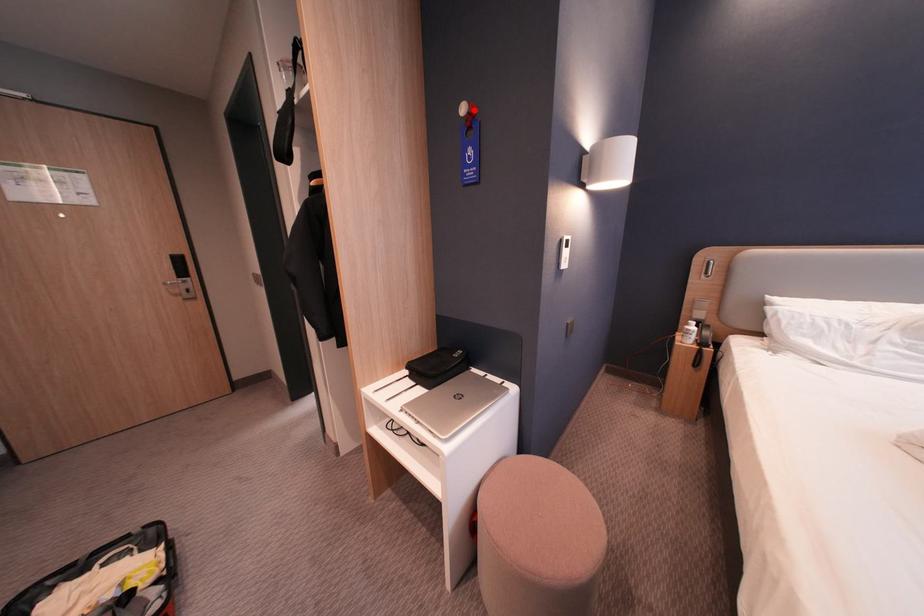
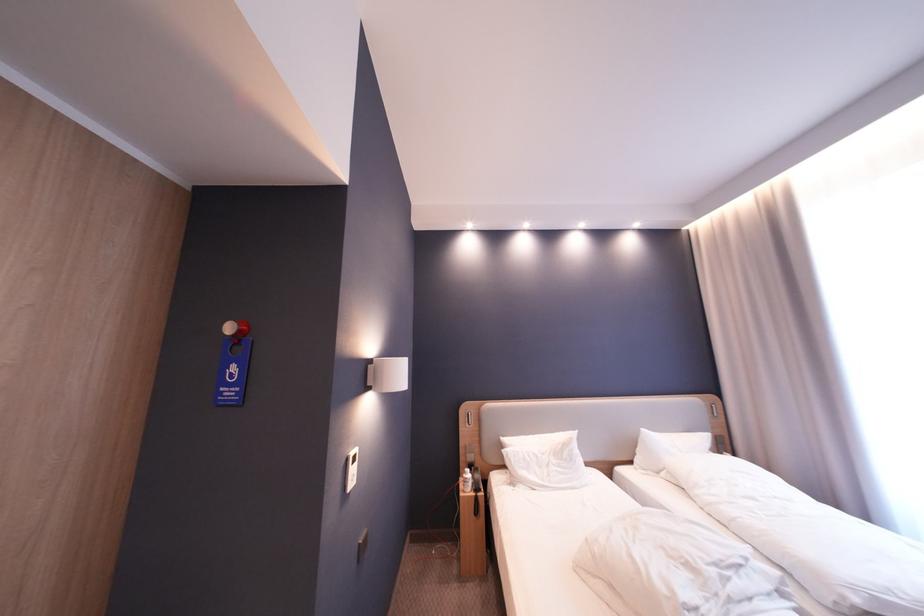
The point at the highlighted location is marked in the first image. Where is the corresponding point in the second image?

(240, 329)